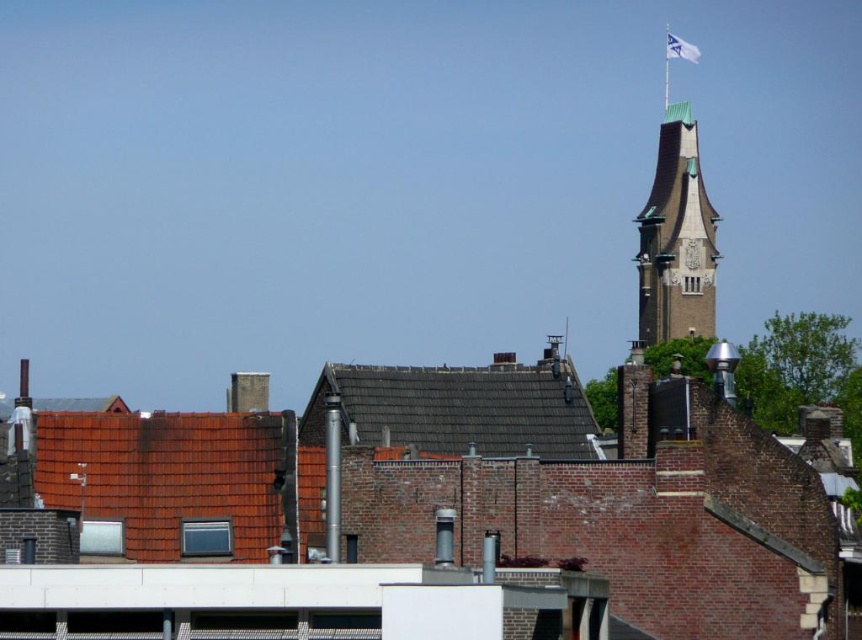
Does brown shingles at center have a larger size compared to white fabric flag at upper right?

No, brown shingles at center is not bigger than white fabric flag at upper right.

Between brown shingles at center and white fabric flag at upper right, which one appears on the right side from the viewer's perspective?

Positioned to the right is white fabric flag at upper right.

Image resolution: width=862 pixels, height=640 pixels. Describe the element at coordinates (457, 408) in the screenshot. I see `brown shingles at center` at that location.

Identify the location of brown shingles at center. This screenshot has width=862, height=640. (457, 408).

Identify the location of brown stone tower at upper right. (676, 240).

Can you confirm if brown stone tower at upper right is shorter than white fabric flag at upper right?

In fact, brown stone tower at upper right may be taller than white fabric flag at upper right.

Is point (679, 305) in front of point (669, 56)?

Yes, it is.

Find the location of a particular element. brown stone tower at upper right is located at coordinates (676, 240).

Is brown shingles at center closer to the viewer compared to brown stone tower at upper right?

That is True.

Who is lower down, brown shingles at center or brown stone tower at upper right?

brown shingles at center is lower down.

What do you see at coordinates (457, 408) in the screenshot?
I see `brown shingles at center` at bounding box center [457, 408].

Find the location of a particular element. brown shingles at center is located at coordinates (457, 408).